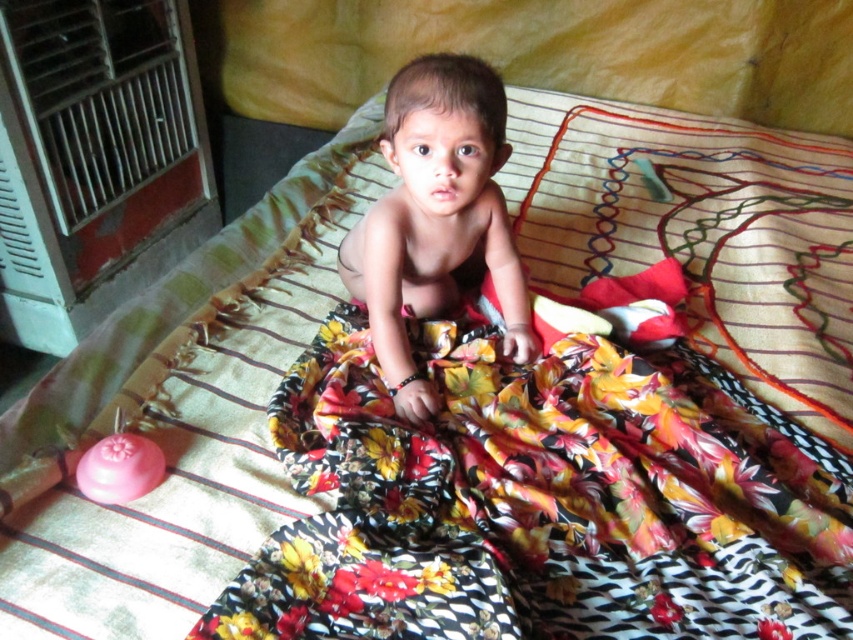
Is point (399, 627) closer to camera compared to point (462, 106)?

Yes, point (399, 627) is in front of point (462, 106).

Identify the location of floral fabric blanket at center. (543, 500).